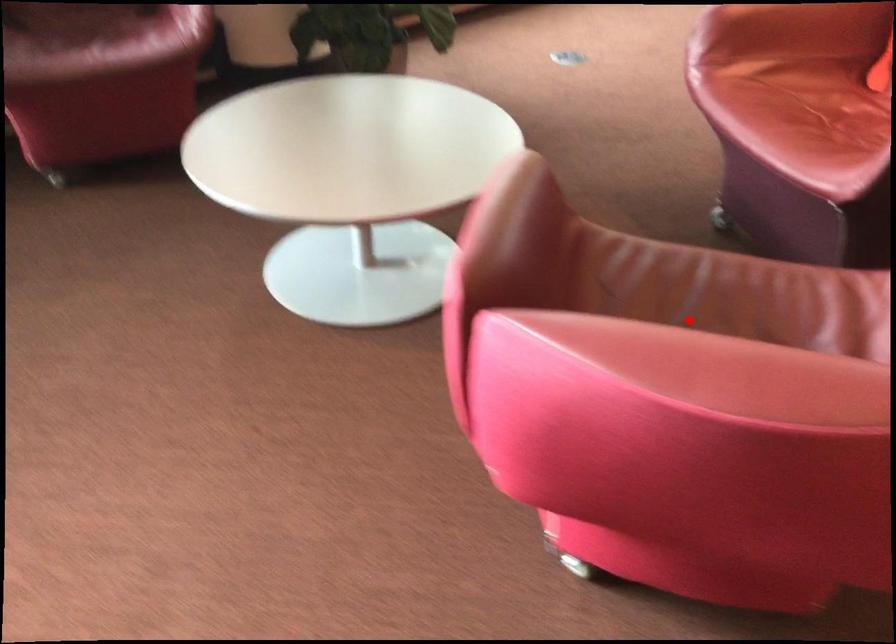
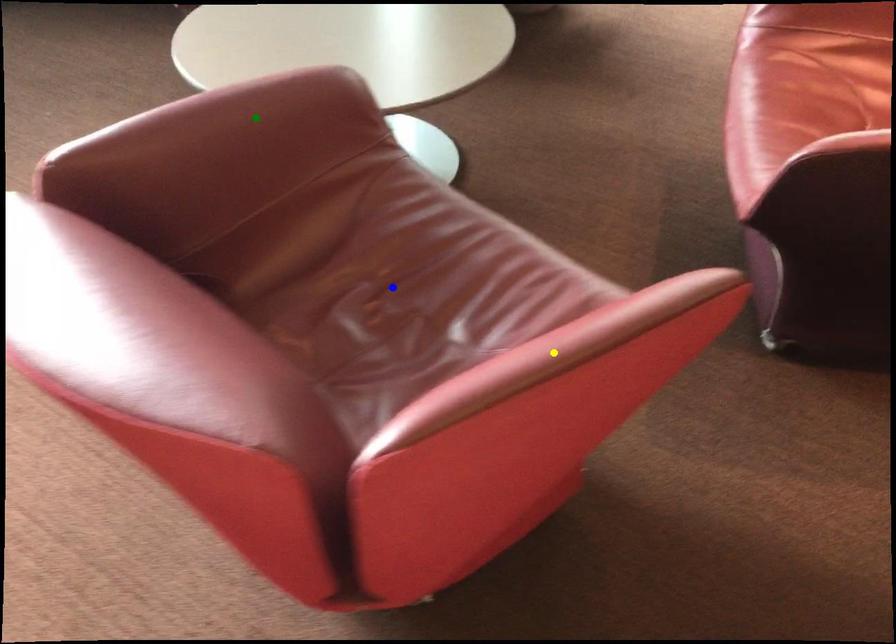
Question: I am providing you with two images of the same scene from different viewpoints. A red point is marked on the first image. You are given multiple points on the second image. Which mark in image 2 goes with the point in image 1?

Choices:
 (A) green point
 (B) yellow point
 (C) blue point

Answer: (C)